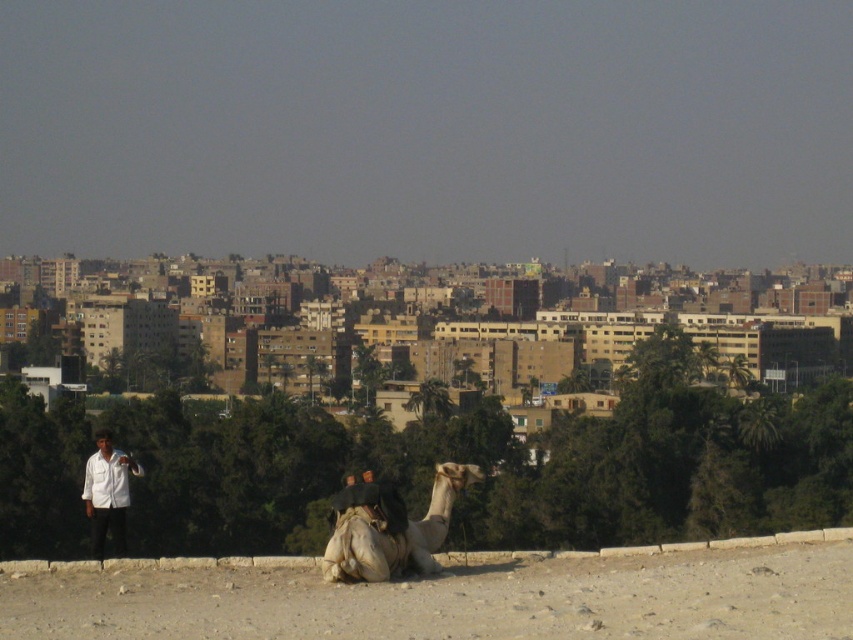
Between beige sand camel at lower center and light beige textured camel at center, which one appears on the right side from the viewer's perspective?

Positioned to the right is beige sand camel at lower center.

This screenshot has height=640, width=853. What do you see at coordinates (457, 600) in the screenshot?
I see `beige sand camel at lower center` at bounding box center [457, 600].

Identify the location of beige sand camel at lower center. (457, 600).

This screenshot has height=640, width=853. Identify the location of beige sand camel at lower center. (457, 600).

Does point (444, 492) lie behind point (93, 536)?

No.

Looking at this image, is light beige textured camel at center positioned before white matte shirt at left?

Yes, light beige textured camel at center is in front of white matte shirt at left.

Is point (339, 524) positioned before point (115, 508)?

Yes, it is.

Where is `light beige textured camel at center`? This screenshot has height=640, width=853. light beige textured camel at center is located at coordinates (393, 532).

Does beige sand camel at lower center have a greater width compared to white matte shirt at left?

Indeed, beige sand camel at lower center has a greater width compared to white matte shirt at left.

Is beige sand camel at lower center thinner than white matte shirt at left?

In fact, beige sand camel at lower center might be wider than white matte shirt at left.

Between point (409, 634) and point (94, 484), which one is positioned in front?

Point (409, 634)

Identify the location of beige sand camel at lower center. The height and width of the screenshot is (640, 853). (457, 600).